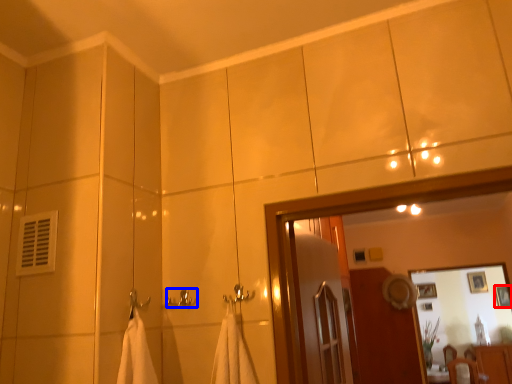
Question: Which of the following is the closest to the observer, picture frame (highlighted by a red box) or towel bar (highlighted by a blue box)?

Choices:
 (A) picture frame
 (B) towel bar

Answer: (B)